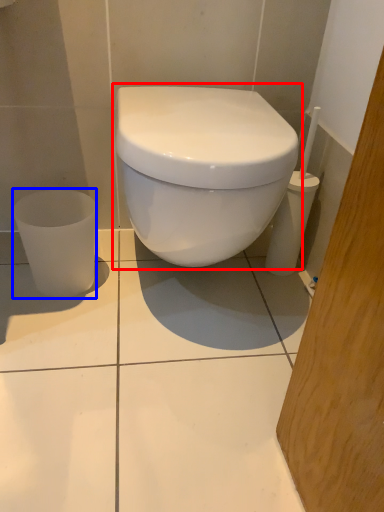
Question: Which point is closer to the camera, toilet (highlighted by a red box) or porcelain (highlighted by a blue box)?

Choices:
 (A) toilet
 (B) porcelain

Answer: (A)